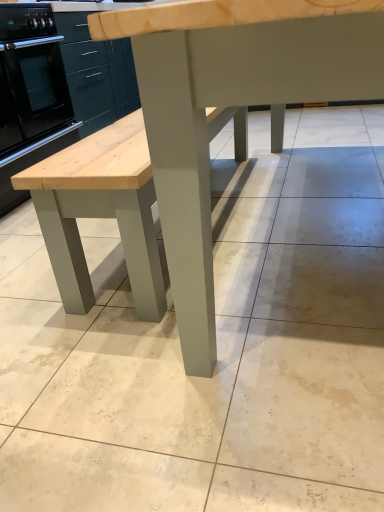
Question: Is black glossy oven at left at the back of matte gray table at center?

Choices:
 (A) yes
 (B) no

Answer: (B)

Question: Does matte gray table at center have a smaller size compared to black glossy oven at left?

Choices:
 (A) yes
 (B) no

Answer: (B)

Question: Can you confirm if matte gray table at center is bigger than black glossy oven at left?

Choices:
 (A) no
 (B) yes

Answer: (B)

Question: From a real-world perspective, is matte gray table at center on black glossy oven at left?

Choices:
 (A) yes
 (B) no

Answer: (A)

Question: Is matte gray table at center positioned far away from black glossy oven at left?

Choices:
 (A) no
 (B) yes

Answer: (B)

Question: From the image's perspective, is matte gray table at center located beneath black glossy oven at left?

Choices:
 (A) no
 (B) yes

Answer: (B)

Question: From a real-world perspective, is black glossy oven at left located higher than matte gray table at center?

Choices:
 (A) no
 (B) yes

Answer: (A)

Question: Is the position of black glossy oven at left more distant than that of matte gray table at center?

Choices:
 (A) no
 (B) yes

Answer: (B)

Question: Is black glossy oven at left aimed at matte gray table at center?

Choices:
 (A) no
 (B) yes

Answer: (B)

Question: Is black glossy oven at left facing away from matte gray table at center?

Choices:
 (A) yes
 (B) no

Answer: (B)

Question: Can you confirm if black glossy oven at left is shorter than matte gray table at center?

Choices:
 (A) no
 (B) yes

Answer: (B)

Question: From the image's perspective, is black glossy oven at left on matte gray table at center?

Choices:
 (A) no
 (B) yes

Answer: (B)

Question: From a real-world perspective, is matte gray table at center above or below black glossy oven at left?

Choices:
 (A) below
 (B) above

Answer: (B)